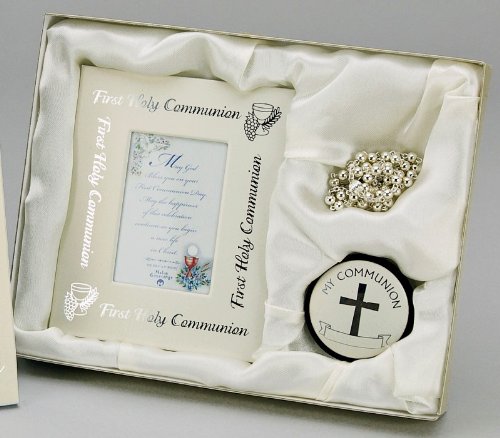
You are a GUI agent. You are given a task and a screenshot of the screen. Output one action in this format:
    pyautogui.click(x=<x>, y=<y>)
    Task: Click on the line art, goblet
    
    Given the screenshot: What is the action you would take?
    pyautogui.click(x=79, y=295), pyautogui.click(x=261, y=113)